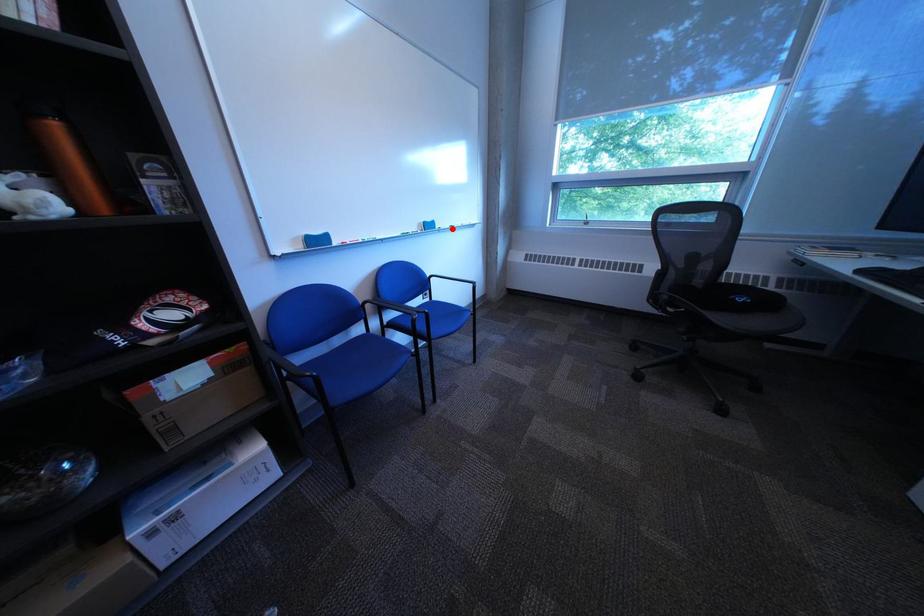
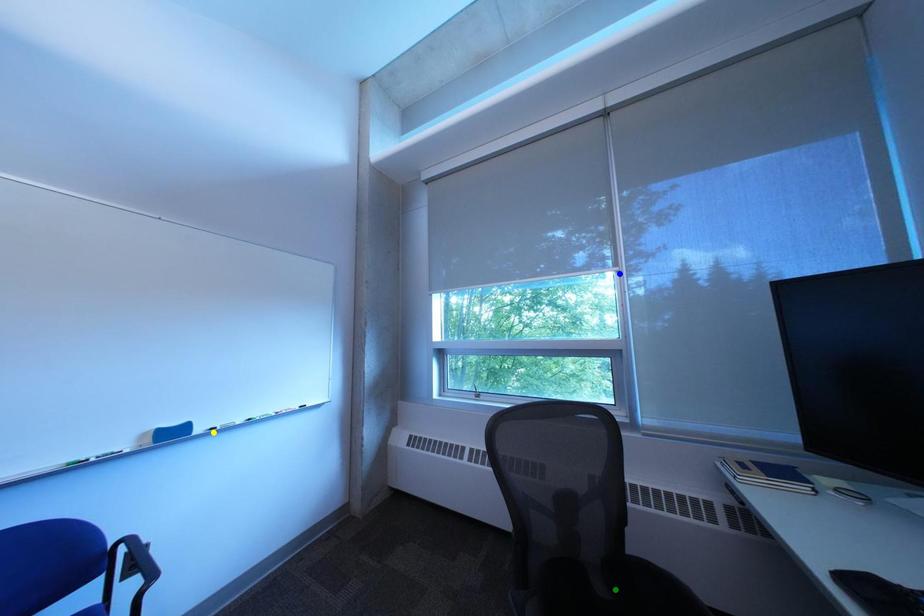
Question: I am providing you with two images of the same scene from different viewpoints. A red point is marked on the first image. You are given multiple points on the second image. Which point in image 2 is actually the same real-world point as the red point in image 1?

Choices:
 (A) green point
 (B) yellow point
 (C) blue point

Answer: (B)